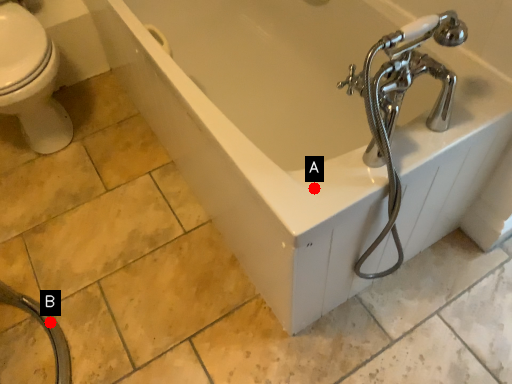
Question: Two points are circled on the image, labeled by A and B beside each circle. Among these points, which one is farthest from the camera?

Choices:
 (A) A is further
 (B) B is further

Answer: (B)